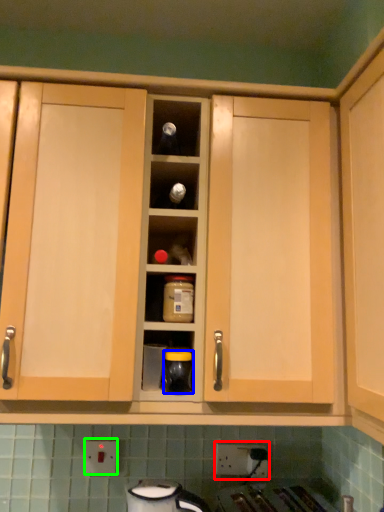
Question: Considering the real-world distances, which object is farthest from electric outlet (highlighted by a red box)? appliance (highlighted by a blue box) or electric outlet (highlighted by a green box)?

Choices:
 (A) appliance
 (B) electric outlet

Answer: (A)